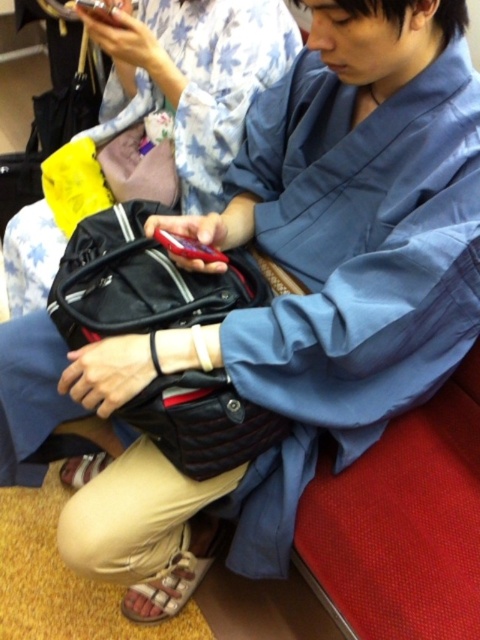
What is located at the coordinates point (155, 122)?

The matte black bag at center is located at point (155, 122).

You are a passenger sitting in the train and want to place your matte black bag at center on the seat next to you. The seat has a coordinate system where the bottom left corner is the origin. Can you place the bag at coordinates x between 0.1 and 0.2 and y between 0.3 and 0.4?

The position of matte black bag at center is at point (155, 122), so yes, the bag can be placed at x between 0.1 and 0.2 and y between 0.3 and 0.4 since the coordinates fall within those ranges.